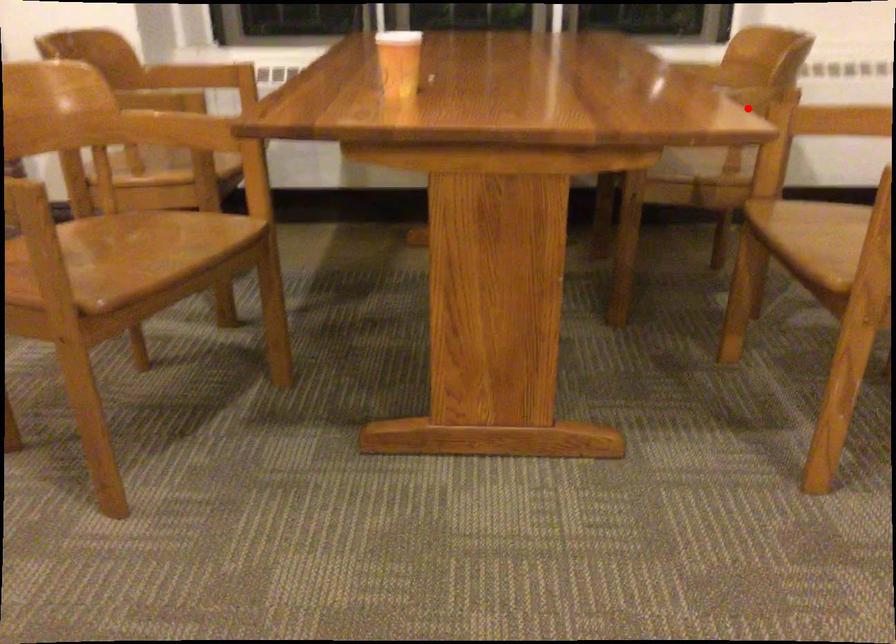
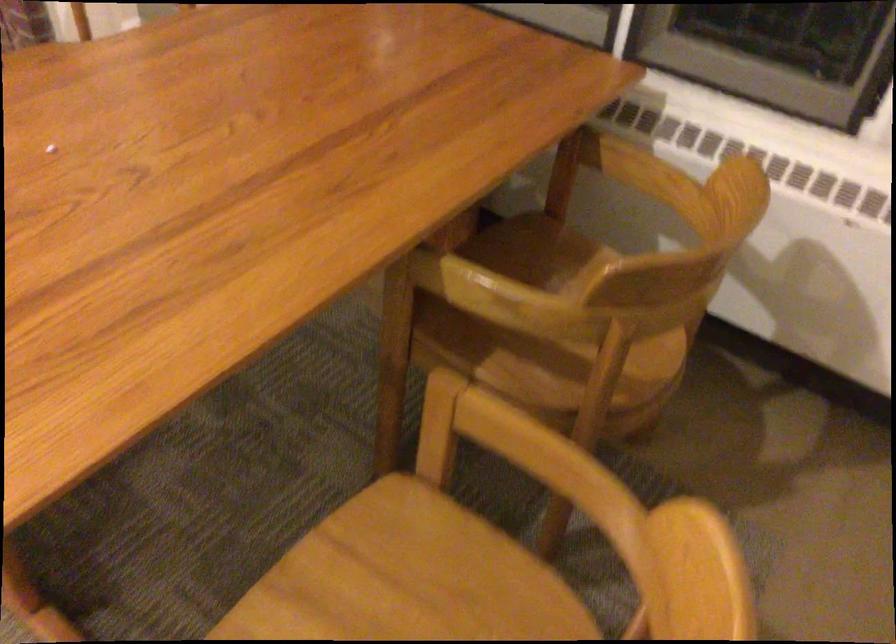
Question: A red point is marked in image1. In image2, is the corresponding 3D point closer to the camera or farther? Reply with the corresponding letter.

Choices:
 (A) The corresponding 3D point is closer.
 (B) The corresponding 3D point is farther.

Answer: (A)